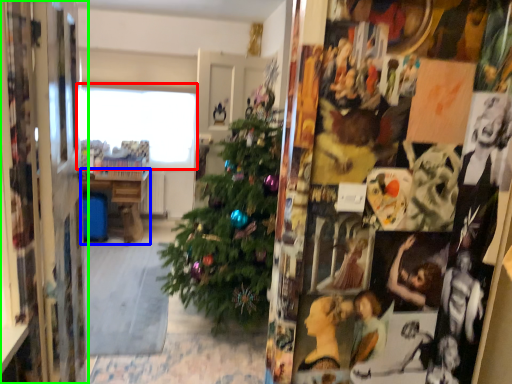
Question: Based on their relative distances, which object is farther from window (highlighted by a red box)? Choose from table (highlighted by a blue box) and collage (highlighted by a green box).

Choices:
 (A) table
 (B) collage

Answer: (B)